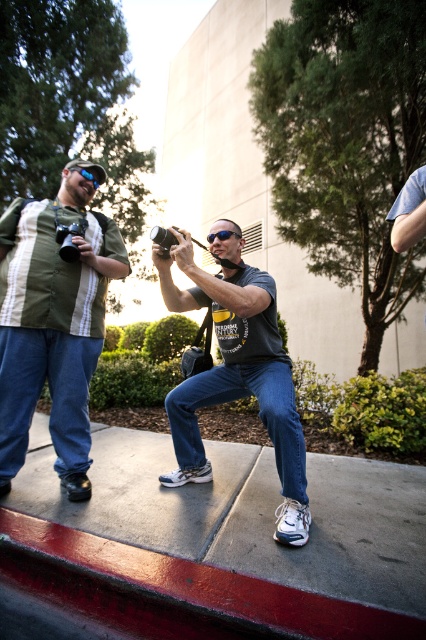
Looking at this image, is matte black camera at center further to the viewer compared to black plastic goggles at center?

Yes, matte black camera at center is further from the viewer.

This screenshot has width=426, height=640. What do you see at coordinates (69, 237) in the screenshot?
I see `matte black camera at center` at bounding box center [69, 237].

This screenshot has width=426, height=640. What are the coordinates of `matte black camera at center` in the screenshot? It's located at (69, 237).

Can you confirm if matte green shirt at left is positioned to the left of matte black camera at center?

Correct, you'll find matte green shirt at left to the left of matte black camera at center.

Does matte green shirt at left have a smaller size compared to matte black camera at center?

No.

Where is `matte green shirt at left`? The height and width of the screenshot is (640, 426). matte green shirt at left is located at coordinates (54, 321).

Measure the distance from matte green shirt at left to black plastic goggles at center.

They are 3.59 feet apart.

Is matte green shirt at left wider than black plastic goggles at center?

Correct, the width of matte green shirt at left exceeds that of black plastic goggles at center.

Does point (63, 461) lie in front of point (224, 237)?

No, (63, 461) is further to viewer.

Image resolution: width=426 pixels, height=640 pixels. What are the coordinates of `matte green shirt at left` in the screenshot? It's located at click(54, 321).